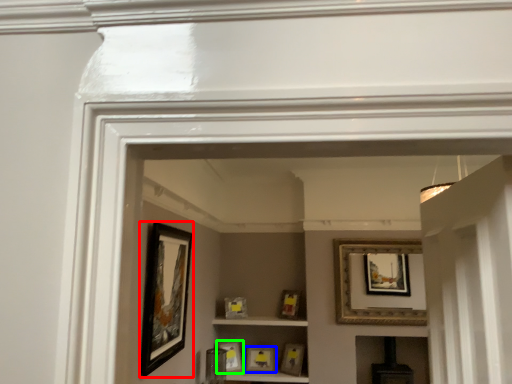
Question: Estimate the real-world distances between objects in this image. Which object is closer to picture frame (highlighted by a red box), picture frame (highlighted by a blue box) or picture frame (highlighted by a green box)?

Choices:
 (A) picture frame
 (B) picture frame

Answer: (B)